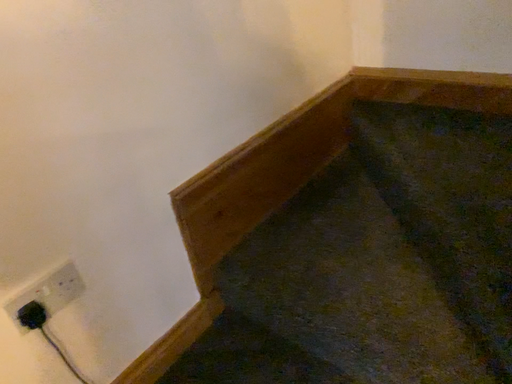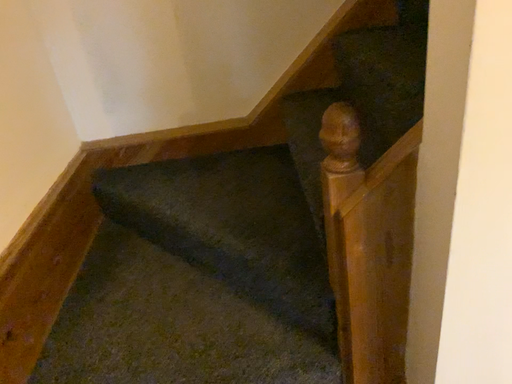
Question: Which way did the camera rotate in the video?

Choices:
 (A) rotated left
 (B) rotated right

Answer: (B)